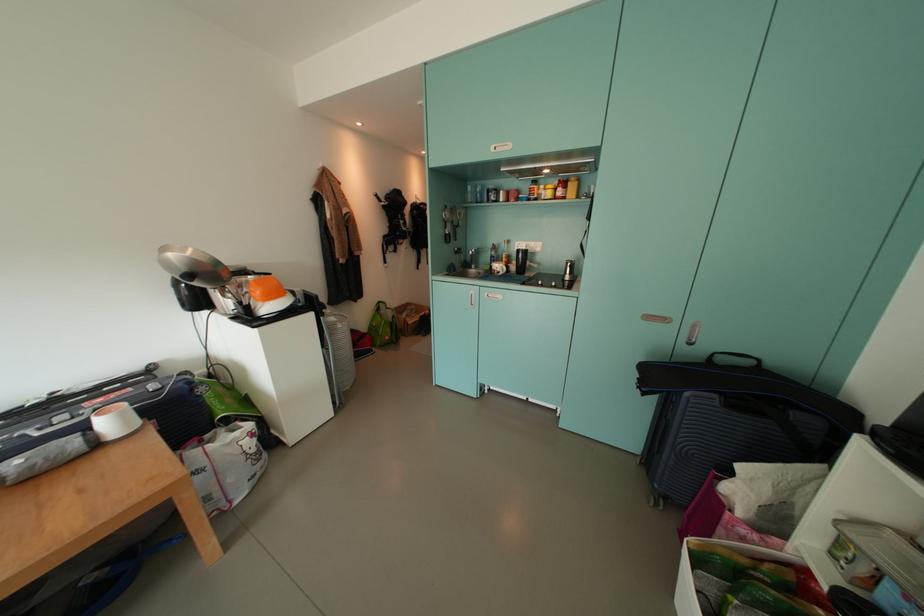
This screenshot has height=616, width=924. Describe the element at coordinates (693, 333) in the screenshot. I see `the recessed silver handle` at that location.